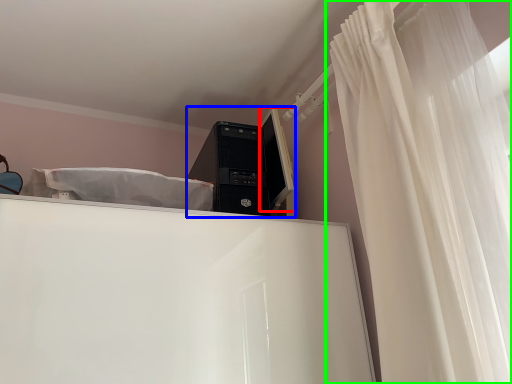
Question: Considering the real-world distances, which object is farthest from computer monitor (highlighted by a red box)? desktop computer (highlighted by a blue box) or curtain (highlighted by a green box)?

Choices:
 (A) desktop computer
 (B) curtain

Answer: (B)